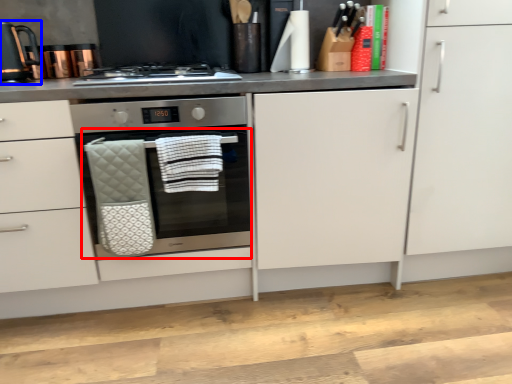
Question: Among these objects, which one is nearest to the camera, oven (highlighted by a red box) or kitchen appliance (highlighted by a blue box)?

Choices:
 (A) oven
 (B) kitchen appliance

Answer: (A)